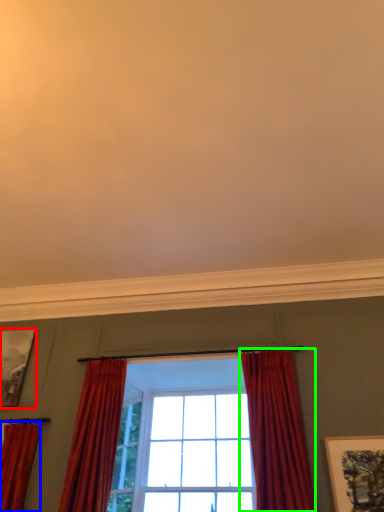
Question: Estimate the real-world distances between objects in this image. Which object is closer to picture frame (highlighted by a red box), curtain (highlighted by a blue box) or curtain (highlighted by a green box)?

Choices:
 (A) curtain
 (B) curtain

Answer: (A)